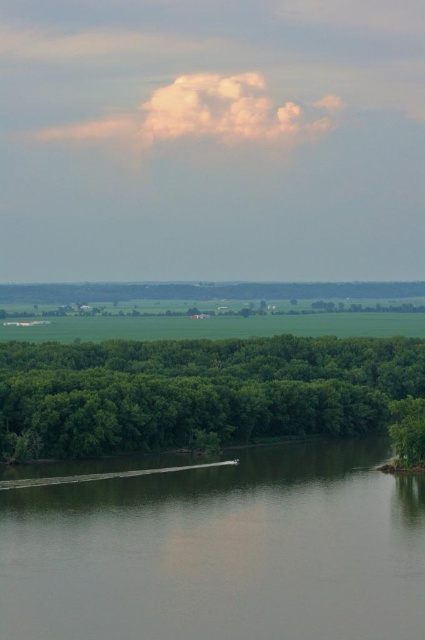
You are standing at the center of the image and want to reach the gray smooth water at lower center. Which direction should you move to reach it?

The gray smooth water at lower center is located at point (221,552), which is to the lower right from the center. Move towards the lower right direction to reach it.

You are a photographer planning to capture the gray smooth water at lower center and the green leafy trees at lower center in a single frame. Based on their sizes in the image, which object will occupy more of the photo?

The green leafy trees at lower center will occupy more of the photo because the gray smooth water at lower center has a smaller size compared to them.

You are standing at the point closest to the water in the image. Which of the two points, point (334,456) or point (240,340), is closer to you?

Point (334,456) is in front of point (240,340), so it is closer to you.